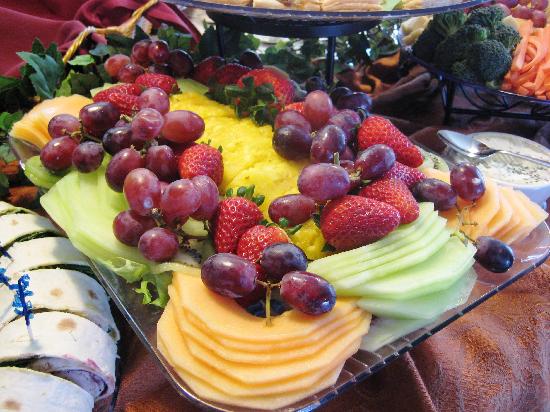
At what (x,y) coordinates should I click in order to perform the action: click on table cloth. Please return your answer as a coordinate pair (x, y). This screenshot has height=412, width=550. Looking at the image, I should click on (509, 386).